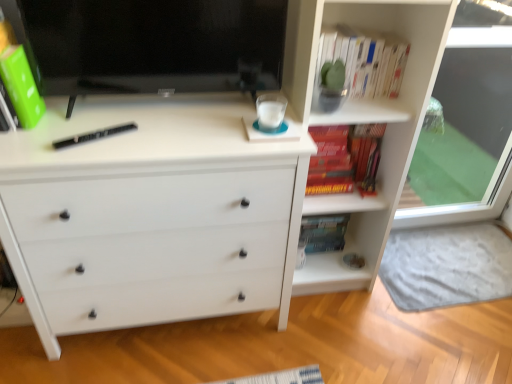
Where is `vacant area that lies between green matte book at upper left, the second paperback book when ordered from back to front, and matte black monitor at upper left`? vacant area that lies between green matte book at upper left, the second paperback book when ordered from back to front, and matte black monitor at upper left is located at coordinates (120, 124).